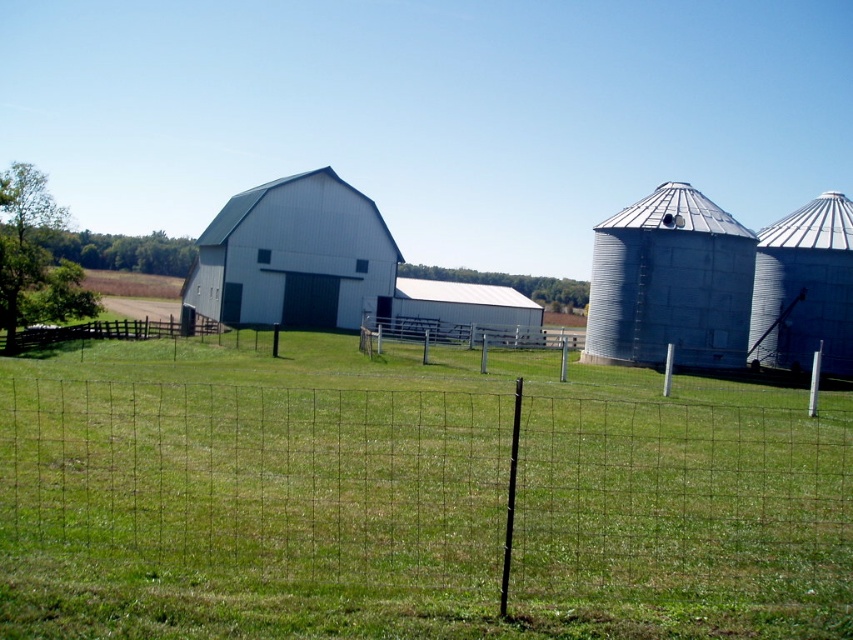
Question: Among these points, which one is farthest from the camera?

Choices:
 (A) (224, 220)
 (B) (462, 339)

Answer: (A)

Question: Does white wood barn at center appear on the left side of wire mesh fence at lower left?

Choices:
 (A) no
 (B) yes

Answer: (A)

Question: Which point is closer to the camera?

Choices:
 (A) (494, 301)
 (B) (438, 339)
 (C) (730, 269)
 (D) (96, 320)

Answer: (C)

Question: Among these points, which one is nearest to the camera?

Choices:
 (A) (776, 353)
 (B) (138, 333)

Answer: (A)

Question: Can you confirm if silver metallic silo at right is wider than wire mesh fence at lower left?

Choices:
 (A) yes
 (B) no

Answer: (B)

Question: Is metallic silver silo at right below white matte barn at center?

Choices:
 (A) no
 (B) yes

Answer: (A)